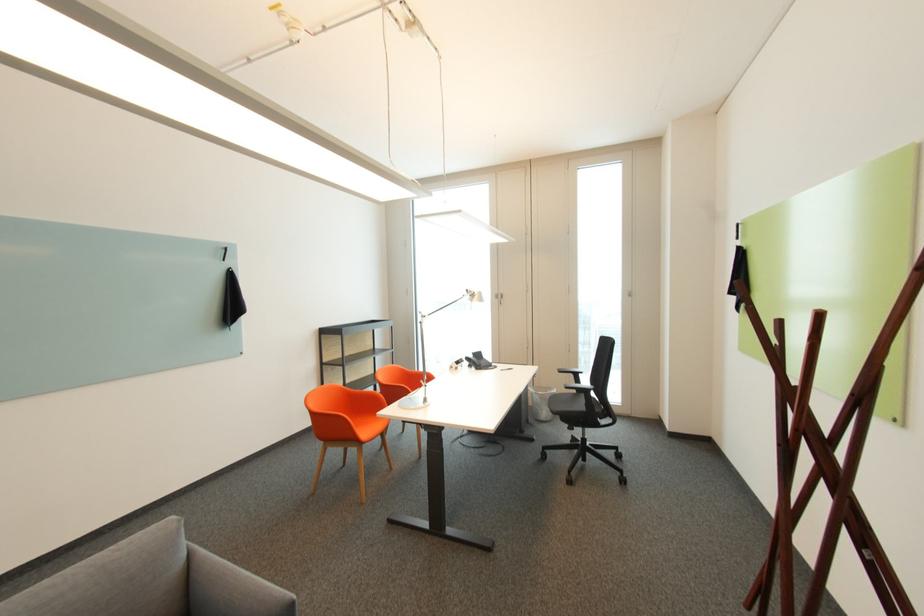
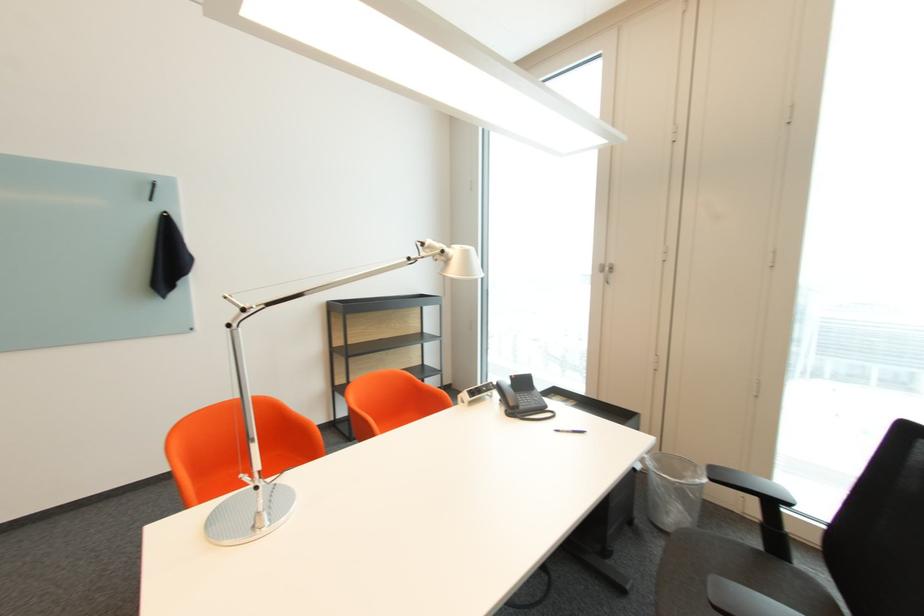
Where in the second image is the point corresponding to (487,365) from the first image?

(524, 407)